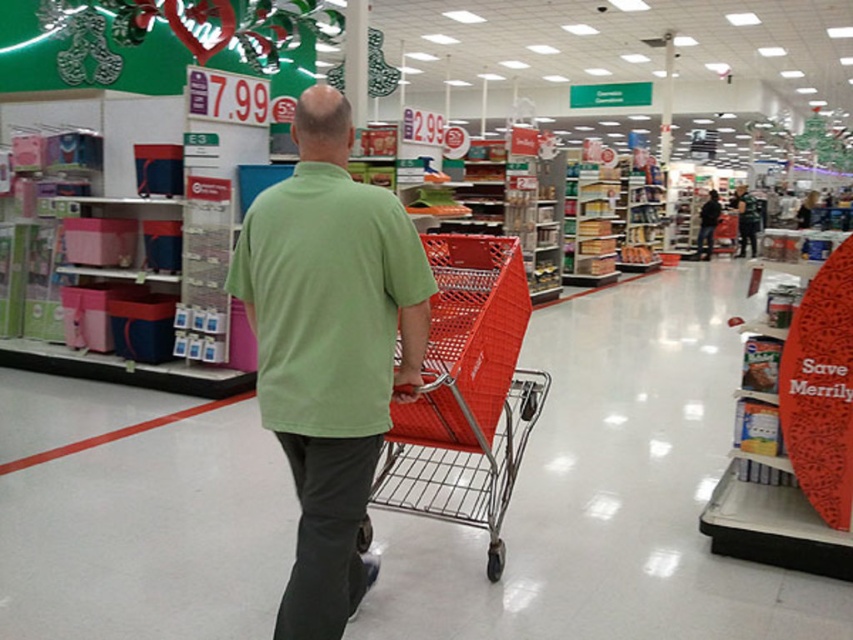
Between green matte shirt at center and metallic red shopping cart at center, which one is positioned higher?

green matte shirt at center is higher up.

Identify the location of green matte shirt at center. This screenshot has height=640, width=853. (329, 348).

Is point (248, 300) less distant than point (509, 490)?

Yes, point (248, 300) is closer to viewer.

You are a GUI agent. You are given a task and a screenshot of the screen. Output one action in this format:
    pyautogui.click(x=<x>, y=<y>)
    Task: Click on the green matte shirt at center
    This screenshot has height=640, width=853.
    Given the screenshot: What is the action you would take?
    pyautogui.click(x=329, y=348)